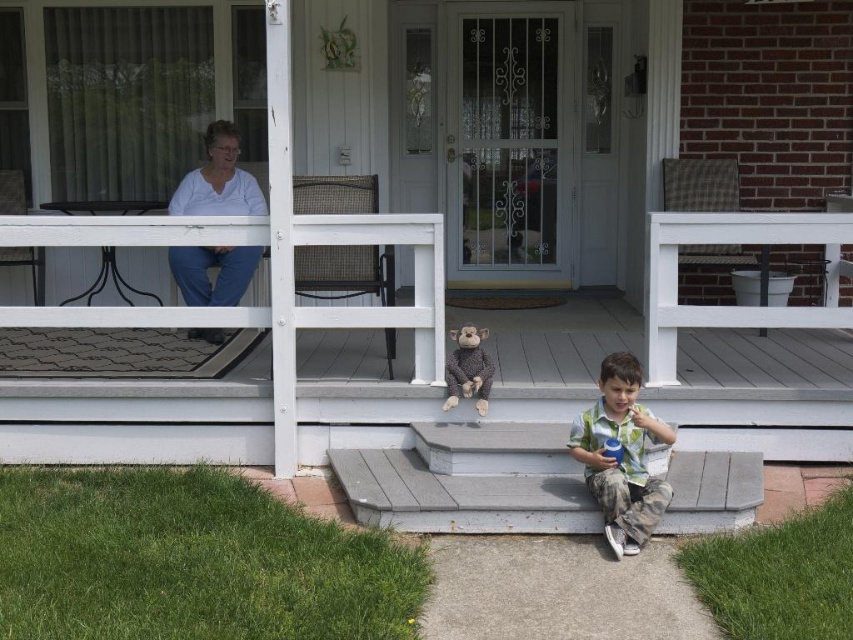
You are a painter who needs to paint the white wooden porch at center and the white cotton shirt at upper left. Which object requires more paint because it has a larger surface area?

The white wooden porch at center requires more paint because it is much taller than the white cotton shirt at upper left, indicating a larger surface area.

You are standing on the grass in front of the house and want to walk to the white wooden porch at center. According to the image, where should you head?

The white wooden porch at center is located at point [241,381] in the image, so you should head towards that coordinate to reach it.